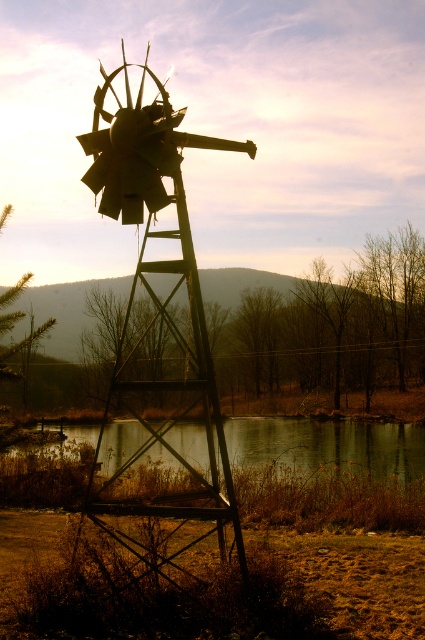
Who is higher up, rusty metal windmill at center or smooth reflective water at lower center?

Positioned higher is rusty metal windmill at center.

Is point (176, 326) farther from camera compared to point (206, 452)?

Yes, it is.

Identify the location of rusty metal windmill at center. This screenshot has height=640, width=425. (159, 296).